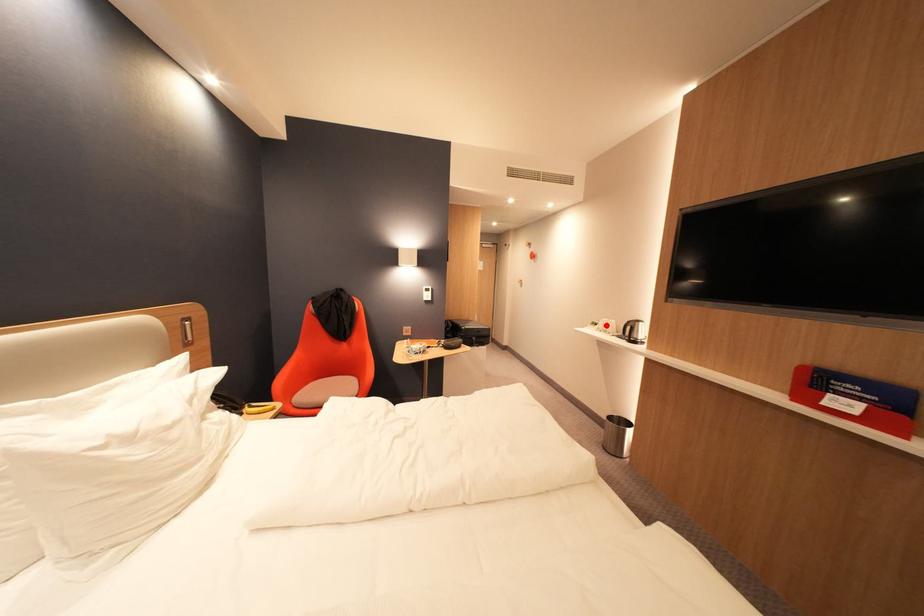
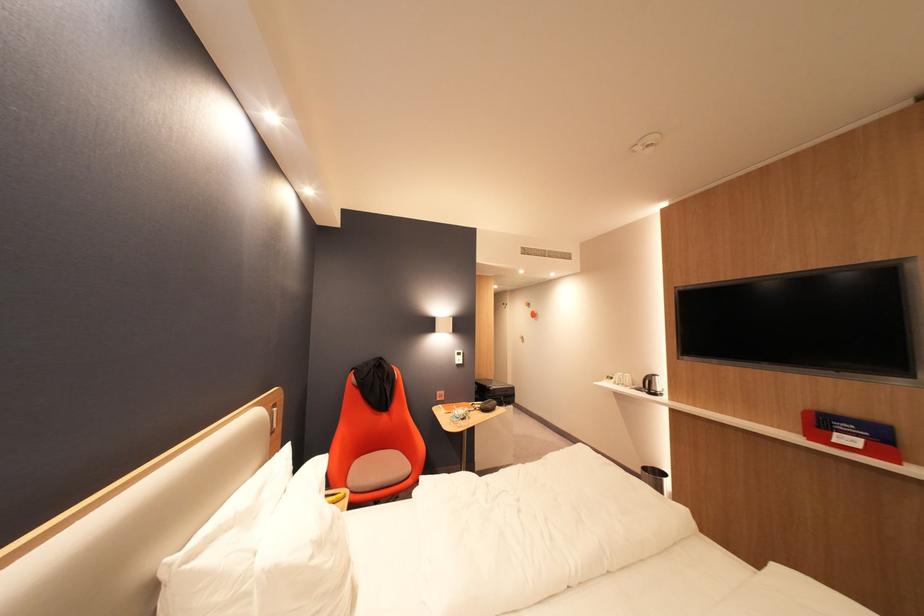
The point at the highlighted location is marked in the first image. Where is the corresponding point in the second image?

(622, 379)